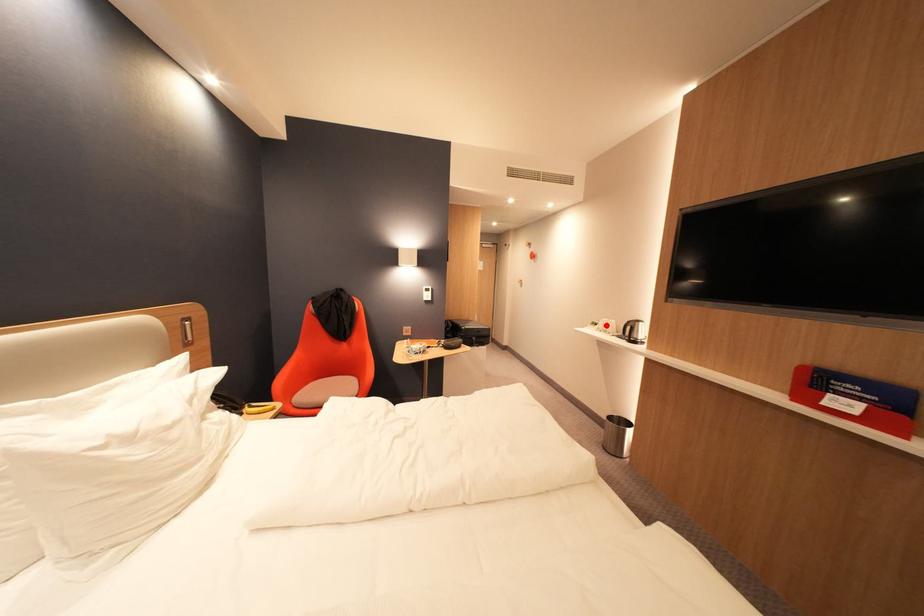
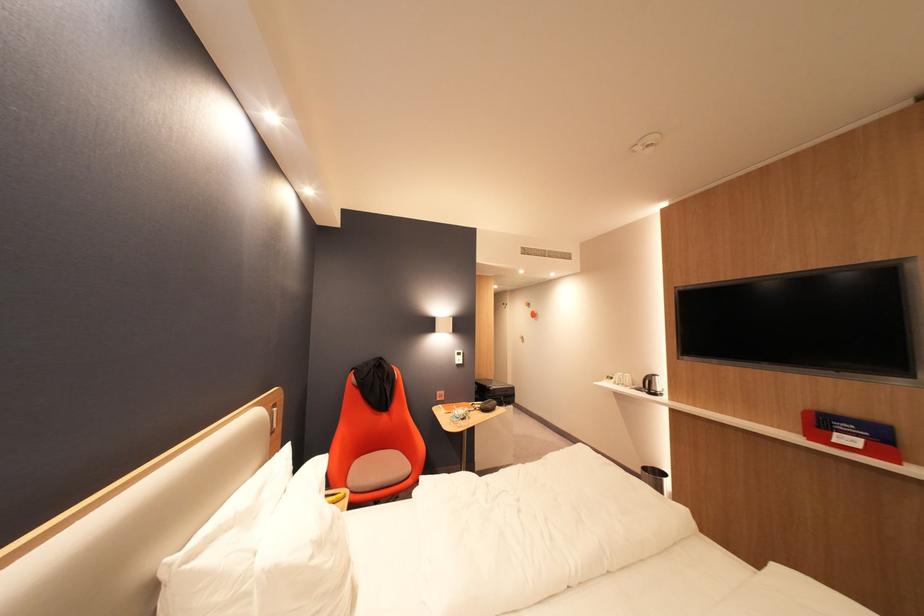
The point at the highlighted location is marked in the first image. Where is the corresponding point in the second image?

(622, 379)